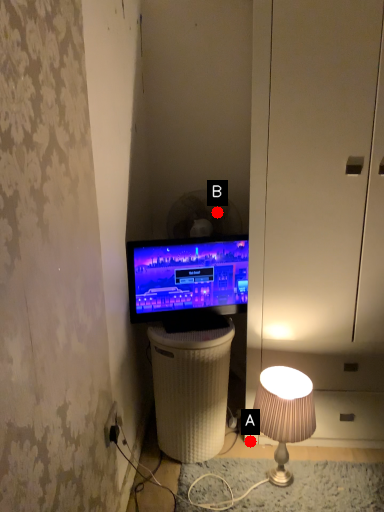
Question: Two points are circled on the image, labeled by A and B beside each circle. Which point is farther to the camera?

Choices:
 (A) A is further
 (B) B is further

Answer: (B)